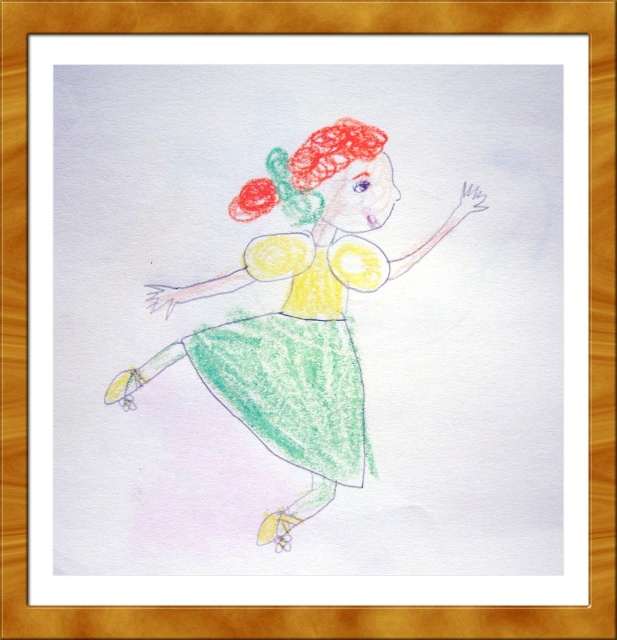
Question: Which of the following is the closest to the observer?

Choices:
 (A) (387, 272)
 (B) (296, 234)

Answer: (A)

Question: From the image, what is the correct spatial relationship of pastel green dress at center in relation to pastel green crayon dress at center?

Choices:
 (A) left
 (B) right

Answer: (A)

Question: Which object is farther from the camera taking this photo?

Choices:
 (A) pastel green crayon dress at center
 (B) pastel green dress at center

Answer: (A)

Question: Is pastel green dress at center thinner than pastel green crayon dress at center?

Choices:
 (A) yes
 (B) no

Answer: (B)

Question: Is pastel green dress at center above pastel green crayon dress at center?

Choices:
 (A) yes
 (B) no

Answer: (A)